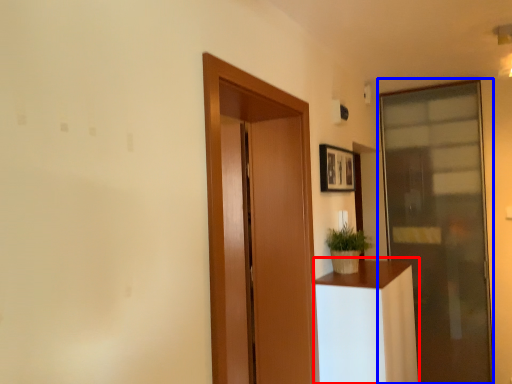
Question: Among these objects, which one is farthest to the camera, furniture (highlighted by a red box) or door (highlighted by a blue box)?

Choices:
 (A) furniture
 (B) door

Answer: (B)